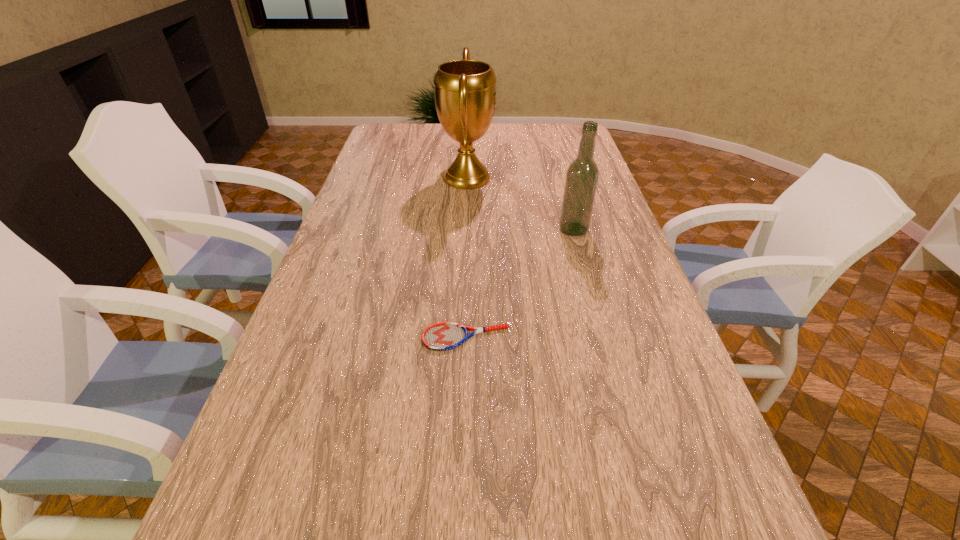
You are a GUI agent. You are given a task and a screenshot of the screen. Output one action in this format:
    pyautogui.click(x=<x>, y=<y>)
    Task: Click on the farthest object
    
    Given the screenshot: What is the action you would take?
    pyautogui.click(x=465, y=92)

Locate an element on the screen. trophy cup is located at coordinates pyautogui.click(x=465, y=92).

Where is `the second farthest object`? Image resolution: width=960 pixels, height=540 pixels. the second farthest object is located at coordinates (582, 175).

Locate an element on the screen. The height and width of the screenshot is (540, 960). the second shortest object is located at coordinates (582, 175).

The image size is (960, 540). I want to click on tennis racket, so click(443, 336).

Where is `the shortest object`? the shortest object is located at coordinates tap(443, 336).

I want to click on vacant space located 0.250m on the surface of the farthest object with symbols, so click(x=561, y=178).

Where is `blank area located 0.360m on the front of the second tallest object`? This screenshot has height=540, width=960. blank area located 0.360m on the front of the second tallest object is located at coordinates (600, 323).

You are a GUI agent. You are given a task and a screenshot of the screen. Output one action in this format:
    pyautogui.click(x=<x>, y=<y>)
    Task: Click on the vacant space located on the left of the tennis racket
    This screenshot has height=540, width=960.
    Given the screenshot: What is the action you would take?
    pyautogui.click(x=290, y=338)

The height and width of the screenshot is (540, 960). I want to click on object that is at the right edge, so click(x=582, y=175).